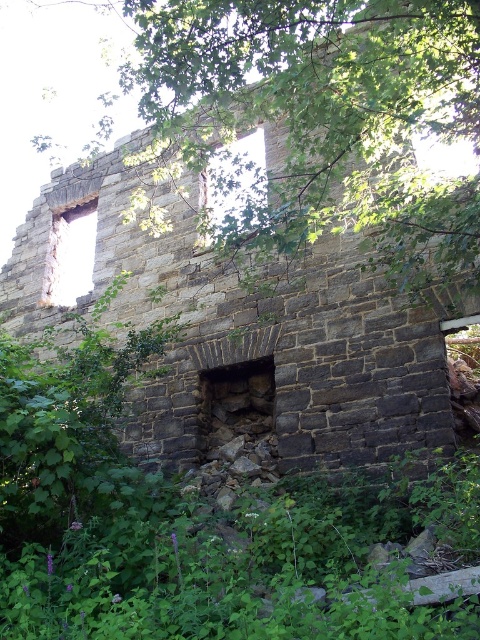
You are standing at the entrance of the old stone structure and see two points marked on the wall. The first point is at coordinates point (156, 113) and the second is at point (233, 212). Which point is closer to you?

Point (233, 212) is closer to you because it is in front of point (156, 113).